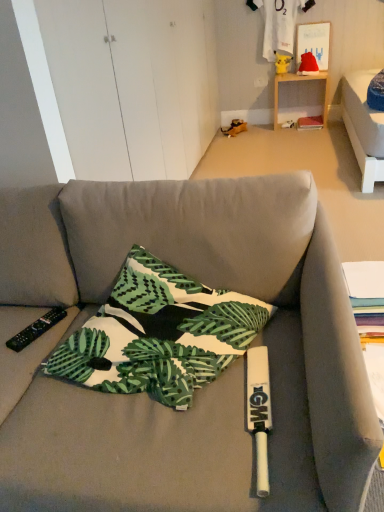
At what (x,y) coordinates should I click in order to perform the action: click on wooden shelf at upper right. Please return your answer as a coordinate pair (x, y). Looking at the image, I should click on (298, 81).

The image size is (384, 512). I want to click on white cotton t-shirt at upper center, so click(279, 24).

Identify the location of black plastic remote control at lower left. (36, 329).

Locate an element on the screen. This screenshot has height=512, width=384. printed fabric pillow at center is located at coordinates (159, 334).

Measure the distance between point (177, 272) and camera.

Point (177, 272) is 1.24 meters from camera.

Find the location of `wooden shelf at upper right`. wooden shelf at upper right is located at coordinates (298, 81).

The image size is (384, 512). What are the coordinates of `pillow that appears on the left of wooden shelf at upper right` in the screenshot? It's located at (159, 334).

Is wooden shelf at upper right positioned with its back to printed fabric pillow at center?

No, wooden shelf at upper right's orientation is not away from printed fabric pillow at center.

Which is in front, wooden shelf at upper right or printed fabric pillow at center?

printed fabric pillow at center is in front.

Which is correct: black plastic remote control at lower left is inside printed fabric pillow at center, or outside of it?

black plastic remote control at lower left exists outside the volume of printed fabric pillow at center.

From a real-world perspective, is black plastic remote control at lower left below printed fabric pillow at center?

Yes.

Is black plastic remote control at lower left positioned before printed fabric pillow at center?

No, black plastic remote control at lower left is further to the viewer.

Which object is positioned more to the right, black plastic remote control at lower left or printed fabric pillow at center?

From the viewer's perspective, printed fabric pillow at center appears more on the right side.

Based on the photo, who is taller, printed fabric pillow at center or wooden shelf at upper right?

With more height is wooden shelf at upper right.

From the image's perspective, is printed fabric pillow at center below wooden shelf at upper right?

Correct, printed fabric pillow at center appears lower than wooden shelf at upper right in the image.

Which is in front, printed fabric pillow at center or wooden shelf at upper right?

printed fabric pillow at center is more forward.

Is wooden shelf at upper right to the left of black plastic remote control at lower left from the viewer's perspective?

No, wooden shelf at upper right is not to the left of black plastic remote control at lower left.

Considering the sizes of objects wooden shelf at upper right and black plastic remote control at lower left in the image provided, who is smaller, wooden shelf at upper right or black plastic remote control at lower left?

Smaller between the two is black plastic remote control at lower left.

Considering the relative sizes of wooden shelf at upper right and black plastic remote control at lower left in the image provided, is wooden shelf at upper right taller than black plastic remote control at lower left?

Indeed, wooden shelf at upper right has a greater height compared to black plastic remote control at lower left.

Which of these two, wooden shelf at upper right or black plastic remote control at lower left, is wider?

With larger width is wooden shelf at upper right.

Looking at this image, is white cotton t-shirt at upper center spatially inside black plastic remote control at lower left, or outside of it?

white cotton t-shirt at upper center is outside black plastic remote control at lower left.

Does white cotton t-shirt at upper center come in front of black plastic remote control at lower left?

No, it is behind black plastic remote control at lower left.

Locate an element on the screen. The height and width of the screenshot is (512, 384). fabric located on the right of black plastic remote control at lower left is located at coordinates (279, 24).

Does point (290, 15) come behind point (33, 322)?

Yes, point (290, 15) is farther from viewer.

From the image's perspective, does black plastic remote control at lower left appear lower than white cotton t-shirt at upper center?

Yes, from the image's perspective, black plastic remote control at lower left is beneath white cotton t-shirt at upper center.

Is point (17, 334) positioned before point (274, 59)?

Yes, point (17, 334) is closer to viewer.

Is black plastic remote control at lower left inside or outside of white cotton t-shirt at upper center?

black plastic remote control at lower left cannot be found inside white cotton t-shirt at upper center.

Could you tell me if black plastic remote control at lower left is turned towards white cotton t-shirt at upper center?

No.

Is white cotton t-shirt at upper center looking in the opposite direction of wooden shelf at upper right?

No.

Is white cotton t-shirt at upper center positioned behind wooden shelf at upper right?

No, white cotton t-shirt at upper center is in front of wooden shelf at upper right.

From a real-world perspective, is white cotton t-shirt at upper center positioned above or below wooden shelf at upper right?

From a real-world perspective, white cotton t-shirt at upper center is physically above wooden shelf at upper right.

In the scene shown: Which object is positioned more to the right, white cotton t-shirt at upper center or wooden shelf at upper right?

wooden shelf at upper right is more to the right.

At what (x,y) coordinates should I click in order to perform the action: click on pillow below the wooden shelf at upper right (from the image's perspective). Please return your answer as a coordinate pair (x, y). Looking at the image, I should click on (159, 334).

Where is `pillow above the black plastic remote control at lower left (from the image's perspective)`? Image resolution: width=384 pixels, height=512 pixels. pillow above the black plastic remote control at lower left (from the image's perspective) is located at coordinates (159, 334).

Looking at the image, which one is located closer to black plastic remote control at lower left, printed fabric pillow at center or wooden shelf at upper right?

The object closer to black plastic remote control at lower left is printed fabric pillow at center.

Estimate the real-world distances between objects in this image. Which object is further from wooden shelf at upper right, white cotton t-shirt at upper center or printed fabric pillow at center?

printed fabric pillow at center.

When comparing their distances from printed fabric pillow at center, does black plastic remote control at lower left or wooden shelf at upper right seem further?

The object further to printed fabric pillow at center is wooden shelf at upper right.

Which object lies further to the anchor point black plastic remote control at lower left, wooden shelf at upper right or printed fabric pillow at center?

wooden shelf at upper right.

In the scene shown: Considering their positions, is black plastic remote control at lower left positioned further to wooden shelf at upper right than printed fabric pillow at center?

Among the two, black plastic remote control at lower left is located further to wooden shelf at upper right.

Looking at the image, which one is located further to white cotton t-shirt at upper center, black plastic remote control at lower left or wooden shelf at upper right?

Among the two, black plastic remote control at lower left is located further to white cotton t-shirt at upper center.

Looking at the image, which one is located closer to white cotton t-shirt at upper center, printed fabric pillow at center or black plastic remote control at lower left?

printed fabric pillow at center is positioned closer to the anchor white cotton t-shirt at upper center.

From the image, which object appears to be farther from printed fabric pillow at center, wooden shelf at upper right or white cotton t-shirt at upper center?

Based on the image, white cotton t-shirt at upper center appears to be further to printed fabric pillow at center.

The height and width of the screenshot is (512, 384). What are the coordinates of `remote control located between printed fabric pillow at center and white cotton t-shirt at upper center in the depth direction` in the screenshot? It's located at (36, 329).

Image resolution: width=384 pixels, height=512 pixels. What are the coordinates of `remote control between printed fabric pillow at center and wooden shelf at upper right from front to back` in the screenshot? It's located at (36, 329).

The image size is (384, 512). In order to click on fabric between printed fabric pillow at center and wooden shelf at upper right in the front-back direction in this screenshot , I will do `click(279, 24)`.

The image size is (384, 512). In order to click on fabric positioned between black plastic remote control at lower left and wooden shelf at upper right from near to far in this screenshot , I will do `click(279, 24)`.